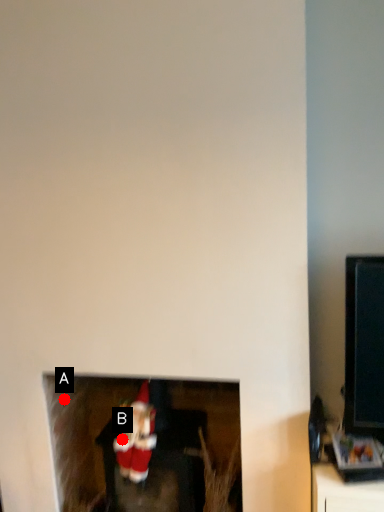
Question: Two points are circled on the image, labeled by A and B beside each circle. Among these points, which one is farthest from the camera?

Choices:
 (A) A is further
 (B) B is further

Answer: (A)